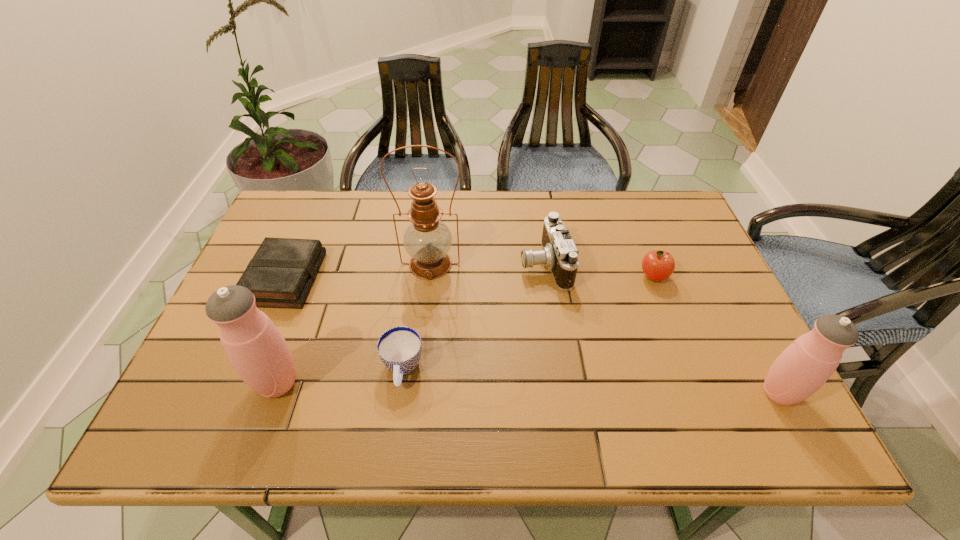
The height and width of the screenshot is (540, 960). Find the location of `vacant space located on the back of the fifth shortest object`. vacant space located on the back of the fifth shortest object is located at coordinates (756, 349).

The width and height of the screenshot is (960, 540). I want to click on vacant area situated on the front of the tallest object, so click(x=415, y=402).

Locate an element on the screen. free location located on the back of the apple is located at coordinates (628, 208).

Where is `free space located at the lens of the third object from right to left`? free space located at the lens of the third object from right to left is located at coordinates (487, 264).

At what (x,y) coordinates should I click in order to perform the action: click on free space located 0.170m at the lens of the third object from right to left. Please return your answer as a coordinate pair (x, y). This screenshot has height=540, width=960. Looking at the image, I should click on (458, 264).

Where is `blank space located at the lens of the third object from right to left`? The width and height of the screenshot is (960, 540). blank space located at the lens of the third object from right to left is located at coordinates (437, 264).

In order to click on free space located on the front of the book in this screenshot , I will do `click(239, 388)`.

At what (x,y) coordinates should I click in order to perform the action: click on cup that is at the near edge. Please return your answer as a coordinate pair (x, y). This screenshot has height=540, width=960. Looking at the image, I should click on (399, 348).

The height and width of the screenshot is (540, 960). Identify the location of thermos bottle situated at the left edge. (256, 349).

The height and width of the screenshot is (540, 960). In order to click on book present at the left edge in this screenshot , I will do (280, 275).